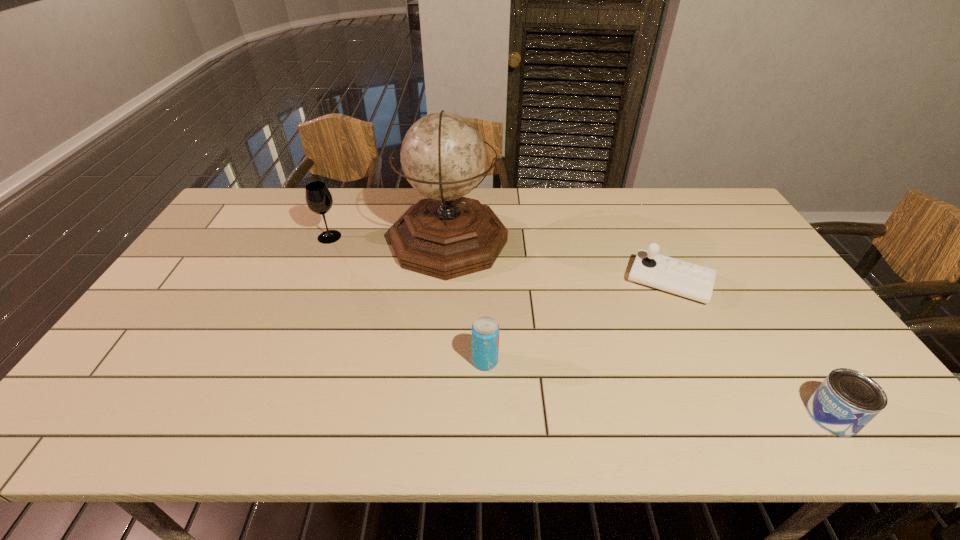
I want to click on vacant space located on the left of the second object from right to left, so click(501, 282).

The width and height of the screenshot is (960, 540). I want to click on free space located 0.150m on the front label of the shortest object, so click(741, 415).

You are a GUI agent. You are given a task and a screenshot of the screen. Output one action in this format:
    pyautogui.click(x=<x>, y=<y>)
    Task: Click on the free space located on the front label of the shortest object
    
    Given the screenshot: What is the action you would take?
    pyautogui.click(x=669, y=415)

Locate an element on the screen. This screenshot has height=540, width=960. vacant space located on the front label of the shortest object is located at coordinates (669, 415).

At what (x,y) coordinates should I click in order to perform the action: click on object present at the far edge. Please return your answer as a coordinate pair (x, y). This screenshot has height=540, width=960. Looking at the image, I should click on (443, 156).

You are a GUI agent. You are given a task and a screenshot of the screen. Output one action in this format:
    pyautogui.click(x=<x>, y=<y>)
    Task: Click on the object that is at the near edge
    The image size is (960, 540).
    Given the screenshot: What is the action you would take?
    pyautogui.click(x=846, y=401)

Locate an element on the screen. This screenshot has height=540, width=960. object at the right edge is located at coordinates (x=846, y=401).

Where is `object that is at the near right corner`? This screenshot has height=540, width=960. object that is at the near right corner is located at coordinates (846, 401).

Identify the location of vacant region at the far edge of the desktop. The image size is (960, 540). (529, 192).

Where is `vacant space at the near edge`? This screenshot has height=540, width=960. vacant space at the near edge is located at coordinates (732, 408).